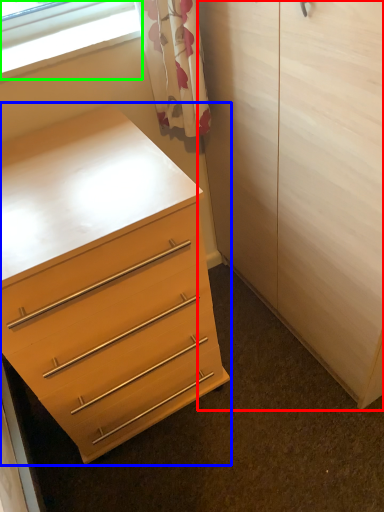
Question: Based on their relative distances, which object is nearer to armoire (highlighted by a red box)? Choose from chest of drawers (highlighted by a blue box) and window (highlighted by a green box).

Choices:
 (A) chest of drawers
 (B) window

Answer: (A)